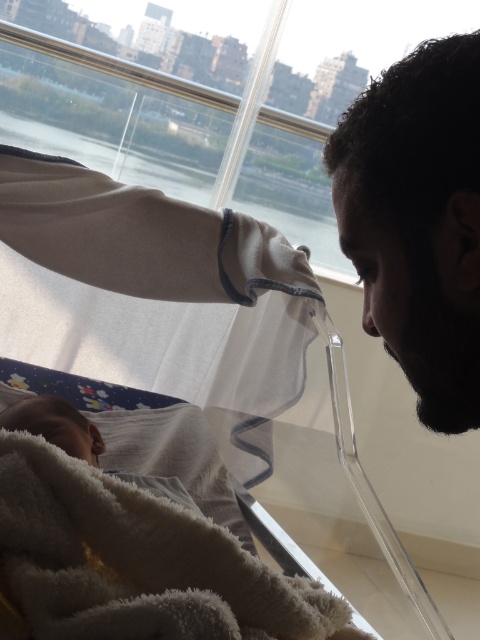
Consider the image. You are a nurse in the hospital room. You need to check the baby in the bassinet. Which object, the dark brown hair at upper right or the white fluffy blanket at lower left, is closer to the baby?

The white fluffy blanket at lower left is closer to the baby because it is at the lower left, while the dark brown hair at upper right is above it.

You are a nurse in the hospital room. You need to place a small medical kit on the bed near the bassinet. The bed is located to the left of the bassinet. Where should you place the medical kit so it is closest to the point marked at coordinate point (x=418, y=220)?

The point marked at coordinate point (x=418, y=220) is on the dark brown hair at upper right, so placing the medical kit near the upper right corner of the bed closest to the dark brown hair at upper right would position it closest to the specified coordinate.

You are a nurse in the hospital room and need to check the baby. You see the dark brown hair at upper right and the white fluffy blanket at lower left. Which object is positioned to the right side of the other?

The dark brown hair at upper right is positioned to the right of the white fluffy blanket at lower left.